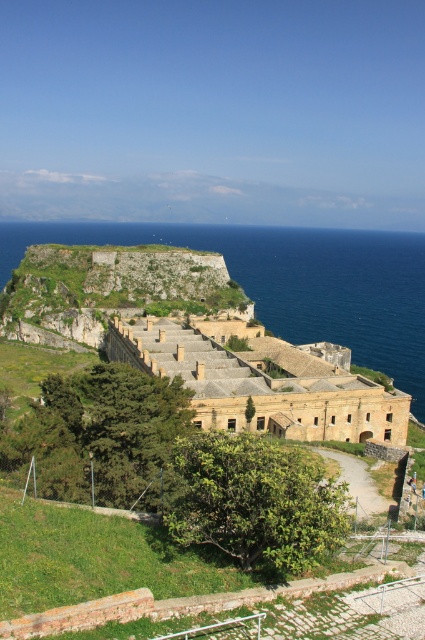
Question: Is blue water at center further to the viewer compared to beige stone building at center?

Choices:
 (A) yes
 (B) no

Answer: (A)

Question: Can you confirm if blue water at center is positioned below green mossy stone wall at center?

Choices:
 (A) yes
 (B) no

Answer: (B)

Question: Which object appears farthest from the camera in this image?

Choices:
 (A) green mossy stone wall at center
 (B) beige stone building at center
 (C) blue water at center

Answer: (A)

Question: Estimate the real-world distances between objects in this image. Which object is farther from the beige stone building at center?

Choices:
 (A) blue water at center
 (B) green mossy stone wall at center

Answer: (A)

Question: Which point is closer to the camera?

Choices:
 (A) green mossy stone wall at center
 (B) beige stone building at center

Answer: (B)

Question: Is blue water at center to the left of green mossy stone wall at center from the viewer's perspective?

Choices:
 (A) no
 (B) yes

Answer: (A)